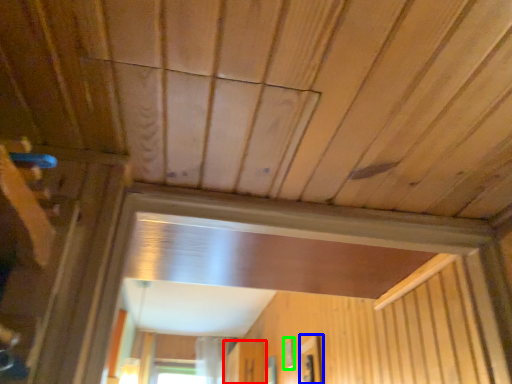
Question: Based on their relative distances, which object is farther from screen door (highlighted by a red box)? Choose from window (highlighted by a blue box) and window (highlighted by a green box).

Choices:
 (A) window
 (B) window

Answer: (A)